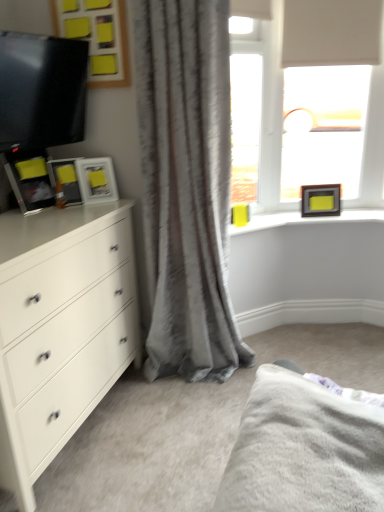
This screenshot has width=384, height=512. I want to click on free spot to the left of matte black picture frame at upper right, placed as the first picture frame when sorted from back to front, so click(288, 219).